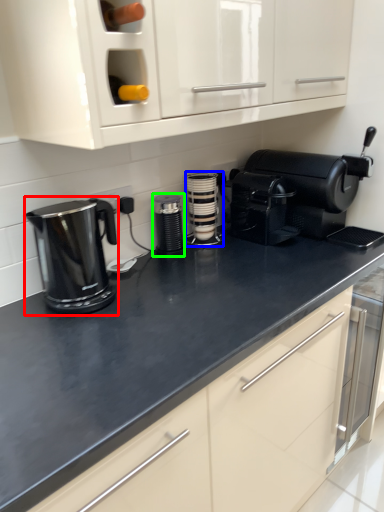
Question: Considering the real-world distances, which object is closest to home appliance (highlighted by a red box)? kitchen appliance (highlighted by a blue box) or kitchen appliance (highlighted by a green box).

Choices:
 (A) kitchen appliance
 (B) kitchen appliance

Answer: (B)